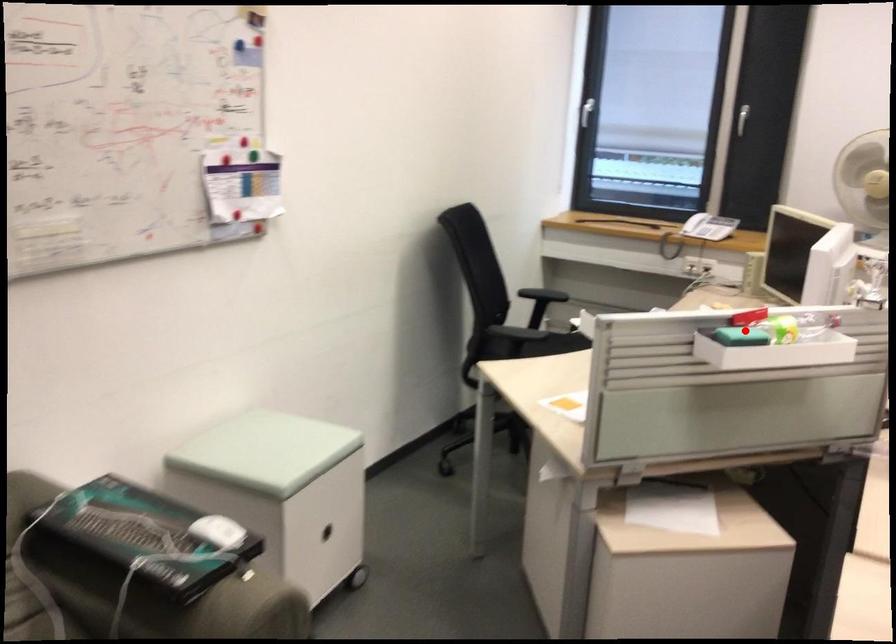
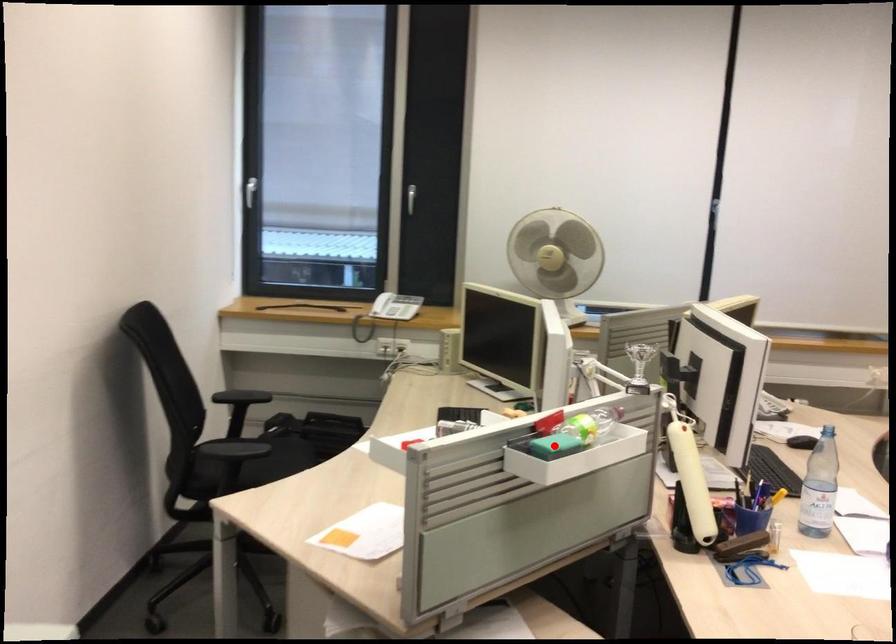
I am providing you with two images of the same scene from different viewpoints. A red point is marked on the first image and another point is marked on the second image. Is the marked point in image1 the same physical position as the marked point in image2?

Yes